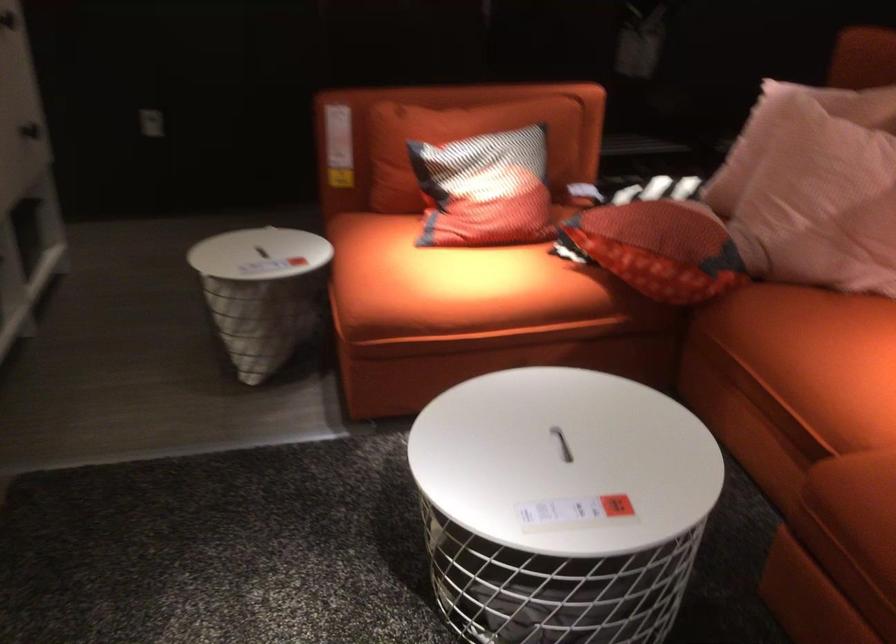
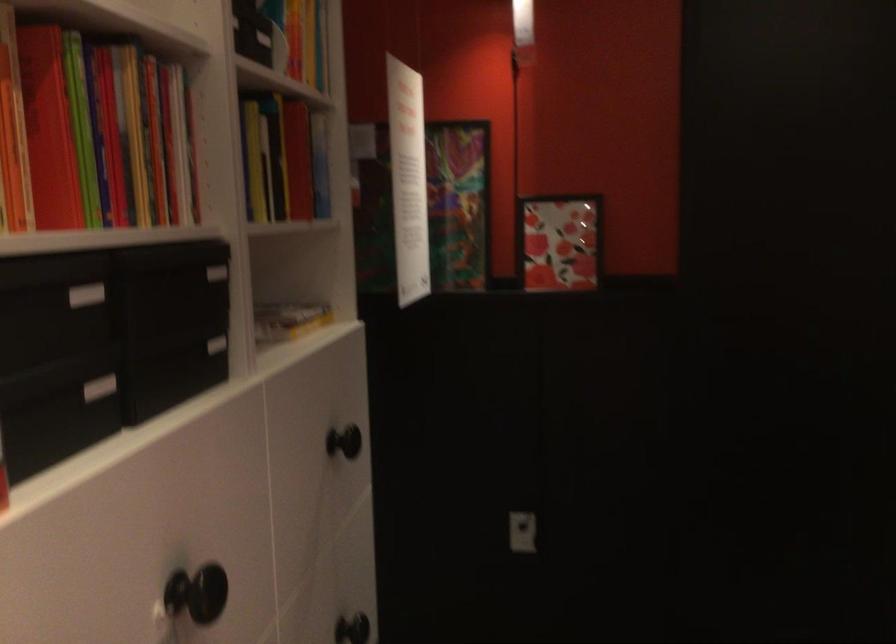
In a continuous first-person perspective shot, in which direction is the camera moving?

The movement direction of the cameraman is left, forward.